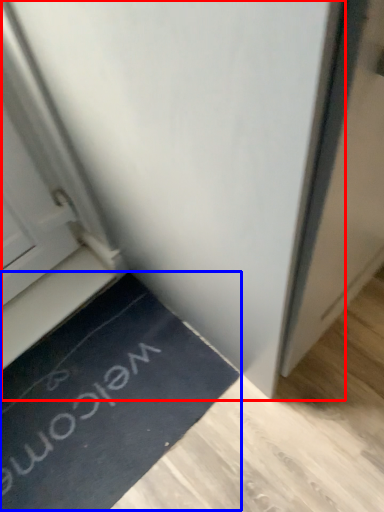
Question: Which object appears closest to the camera in this image, door (highlighted by a red box) or doormat (highlighted by a blue box)?

Choices:
 (A) door
 (B) doormat

Answer: (A)